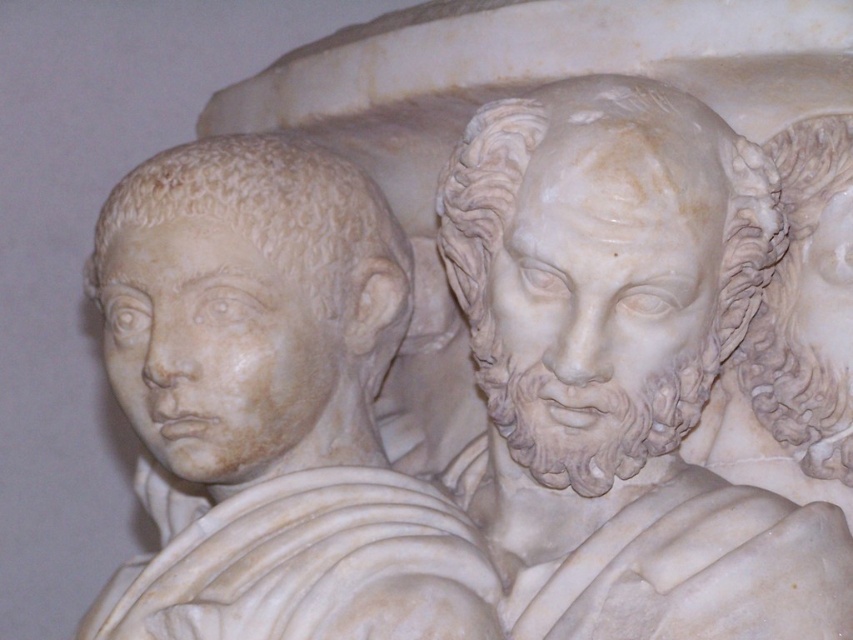
Can you confirm if white marble head at center is thinner than white marble hair at upper right?

In fact, white marble head at center might be wider than white marble hair at upper right.

Is white marble head at center shorter than white marble hair at upper right?

No.

Image resolution: width=853 pixels, height=640 pixels. What do you see at coordinates (602, 268) in the screenshot?
I see `white marble head at center` at bounding box center [602, 268].

At what (x,y) coordinates should I click in order to perform the action: click on white marble head at center. Please return your answer as a coordinate pair (x, y). Image resolution: width=853 pixels, height=640 pixels. Looking at the image, I should click on (602, 268).

Which is more to the right, white marble head at left or white marble hair at upper right?

Positioned to the right is white marble hair at upper right.

Who is more distant from viewer, (x=262, y=378) or (x=788, y=406)?

The point (x=788, y=406) is behind.

This screenshot has height=640, width=853. What do you see at coordinates (248, 307) in the screenshot? I see `white marble head at left` at bounding box center [248, 307].

This screenshot has height=640, width=853. Find the location of `white marble head at left`. white marble head at left is located at coordinates (248, 307).

Does point (686, 120) lie behind point (161, 436)?

No, it is not.

Can you confirm if white marble head at center is taller than white marble head at left?

Yes.

Locate an element on the screen. The image size is (853, 640). white marble head at center is located at coordinates (602, 268).